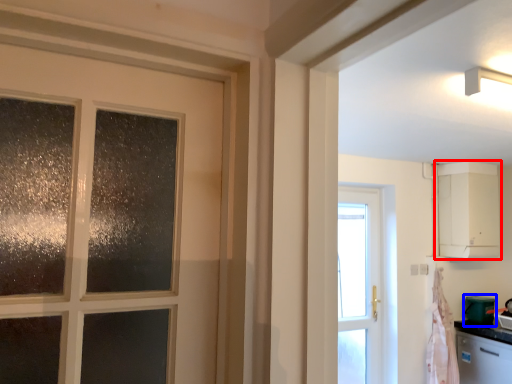
Question: Among these objects, which one is farthest to the camera, cabinetry (highlighted by a red box) or appliance (highlighted by a blue box)?

Choices:
 (A) cabinetry
 (B) appliance

Answer: (B)